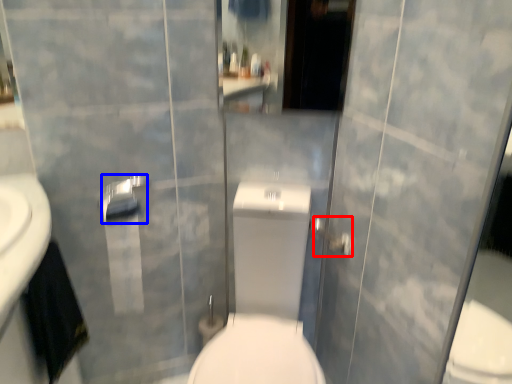
Question: Which object appears closest to the camera in this image, shower (highlighted by a red box) or towel bar (highlighted by a blue box)?

Choices:
 (A) shower
 (B) towel bar

Answer: (B)